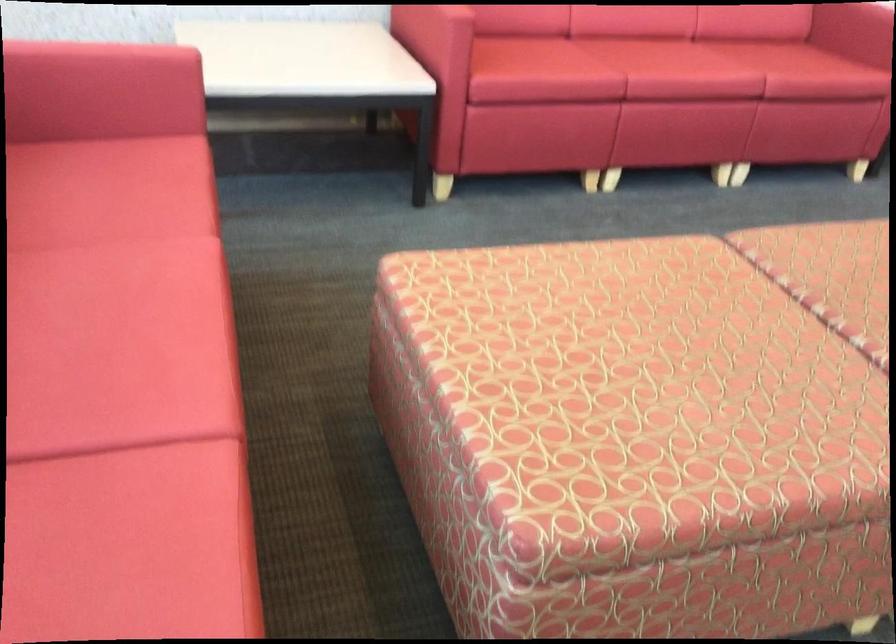
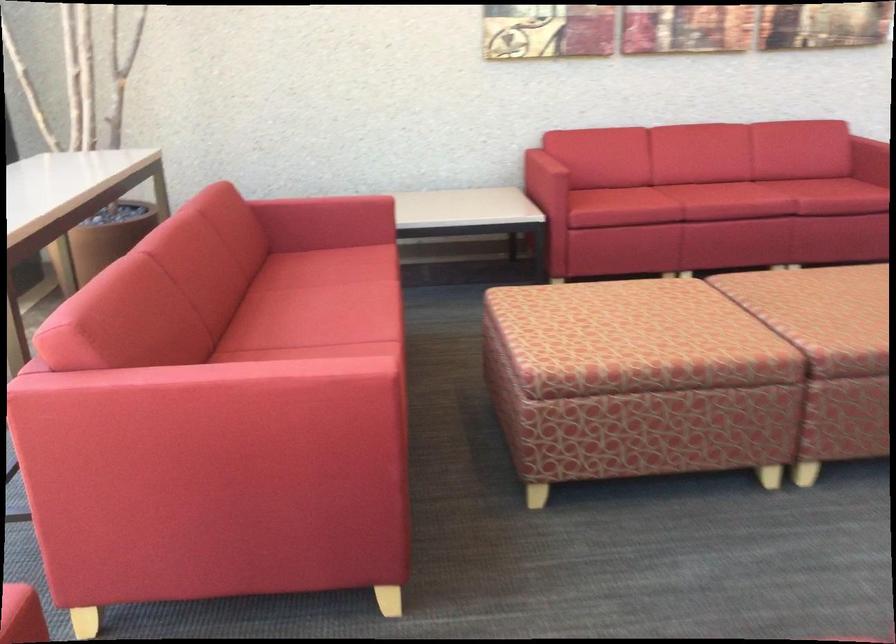
Locate, in the second image, the point that corresponds to [688,86] in the first image.

(725, 201)